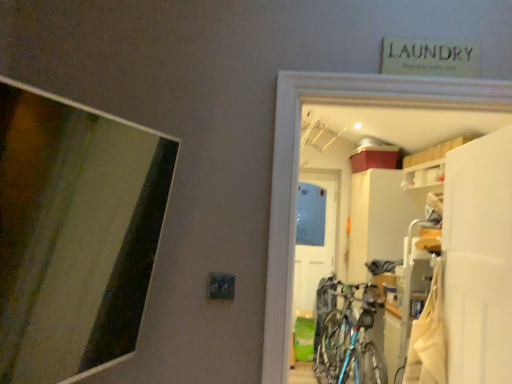
Question: Is blue metallic bicycle at center not close to white matte screen door at right?

Choices:
 (A) no
 (B) yes

Answer: (B)

Question: Is the depth of blue metallic bicycle at center greater than that of white matte screen door at right?

Choices:
 (A) yes
 (B) no

Answer: (A)

Question: Can you confirm if blue metallic bicycle at center is taller than white matte screen door at right?

Choices:
 (A) yes
 (B) no

Answer: (B)

Question: From the image's perspective, is blue metallic bicycle at center located beneath white matte screen door at right?

Choices:
 (A) yes
 (B) no

Answer: (A)

Question: Can we say blue metallic bicycle at center lies outside white matte screen door at right?

Choices:
 (A) yes
 (B) no

Answer: (A)

Question: Which is correct: white matte screen door at right is inside white matte cabinet at upper right, or outside of it?

Choices:
 (A) inside
 (B) outside

Answer: (B)

Question: Considering the positions of white matte screen door at right and white matte cabinet at upper right in the image, is white matte screen door at right wider or thinner than white matte cabinet at upper right?

Choices:
 (A) wide
 (B) thin

Answer: (B)

Question: In terms of height, does white matte screen door at right look taller or shorter compared to white matte cabinet at upper right?

Choices:
 (A) tall
 (B) short

Answer: (A)

Question: Is white matte screen door at right bigger or smaller than white matte cabinet at upper right?

Choices:
 (A) big
 (B) small

Answer: (A)

Question: Relative to white fabric laundry at lower right, is metallic bicycle at center in front or behind?

Choices:
 (A) front
 (B) behind

Answer: (A)

Question: Is metallic bicycle at center bigger or smaller than white fabric laundry at lower right?

Choices:
 (A) small
 (B) big

Answer: (B)

Question: Considering the positions of point (449, 91) and point (440, 345), is point (449, 91) closer or farther from the camera than point (440, 345)?

Choices:
 (A) closer
 (B) farther

Answer: (A)

Question: Considering the positions of metallic bicycle at center and white fabric laundry at lower right in the image, is metallic bicycle at center wider or thinner than white fabric laundry at lower right?

Choices:
 (A) thin
 (B) wide

Answer: (B)

Question: From a real-world perspective, is white matte screen door at right positioned above or below blue metallic bicycle at center?

Choices:
 (A) below
 (B) above

Answer: (B)

Question: Is white matte screen door at right taller or shorter than blue metallic bicycle at center?

Choices:
 (A) tall
 (B) short

Answer: (A)